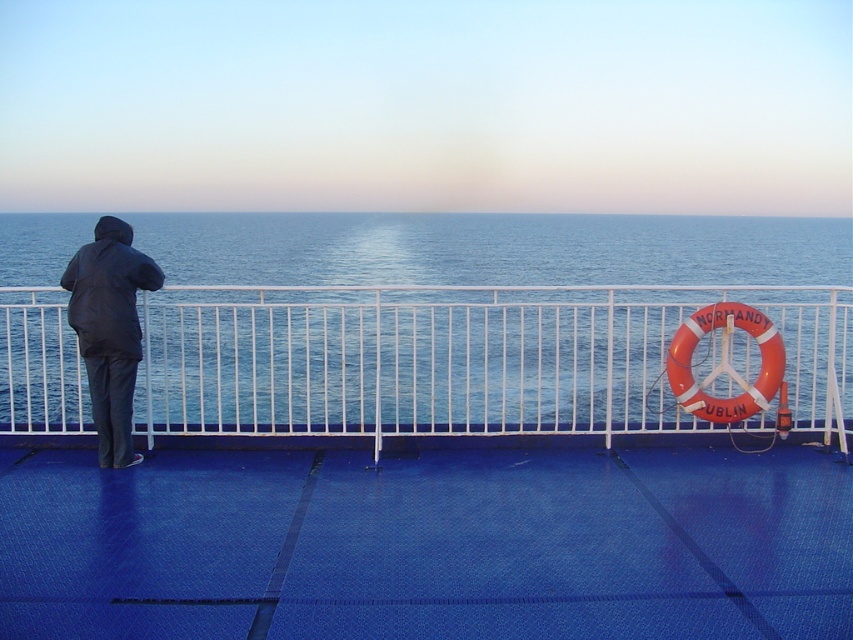
Can you confirm if blue textured deck at center is thinner than white metal fence at left?

No.

Is blue textured deck at center positioned behind white metal fence at left?

No, blue textured deck at center is closer to the viewer.

Locate an element on the screen. The image size is (853, 640). blue textured deck at center is located at coordinates (427, 545).

Between blue textured deck at center and dark blue fabric jacket at left, which one has less height?

With less height is blue textured deck at center.

Is blue textured deck at center behind dark blue fabric jacket at left?

No, it is in front of dark blue fabric jacket at left.

Is point (22, 502) more distant than point (126, 344)?

No.

The width and height of the screenshot is (853, 640). Find the location of `blue textured deck at center`. blue textured deck at center is located at coordinates (427, 545).

Can you confirm if white metal fence at left is shorter than dark blue fabric jacket at left?

Indeed, white metal fence at left has a lesser height compared to dark blue fabric jacket at left.

Does point (656, 397) come behind point (120, 243)?

Yes, point (656, 397) is behind point (120, 243).

Locate an element on the screen. The image size is (853, 640). white metal fence at left is located at coordinates (463, 360).